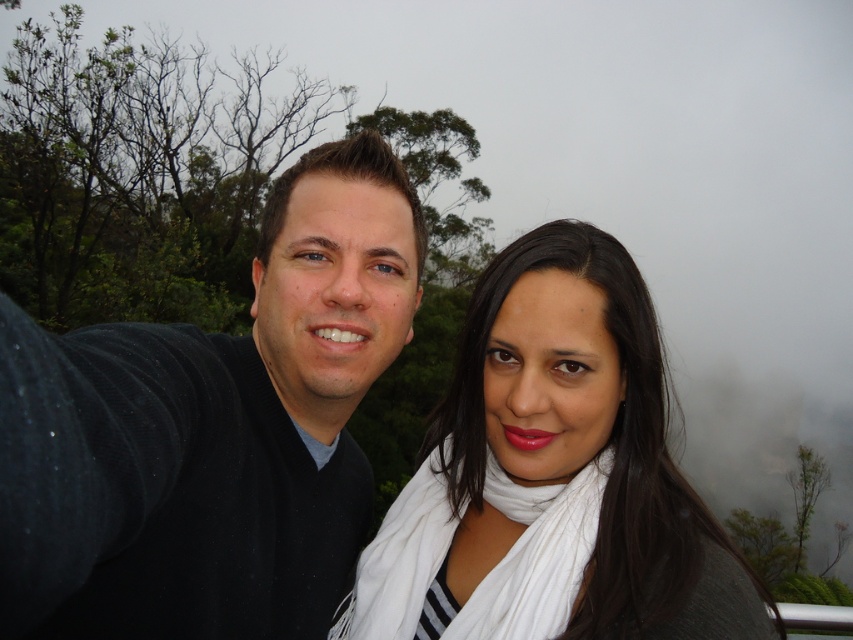
Question: Which object is farther from the camera taking this photo?

Choices:
 (A) black sweater at center
 (B) white scarf at right

Answer: (B)

Question: Considering the real-world distances, which object is closest to the white soft scarf at center?

Choices:
 (A) black sweater at center
 (B) white scarf at right

Answer: (B)

Question: Estimate the real-world distances between objects in this image. Which object is closer to the white scarf at right?

Choices:
 (A) black sweater at center
 (B) white soft scarf at center

Answer: (B)

Question: Is black sweater at center positioned in front of white soft scarf at center?

Choices:
 (A) yes
 (B) no

Answer: (A)

Question: Can you confirm if black sweater at center is positioned to the right of white scarf at right?

Choices:
 (A) yes
 (B) no

Answer: (B)

Question: In this image, where is black sweater at center located relative to white soft scarf at center?

Choices:
 (A) above
 (B) below

Answer: (A)